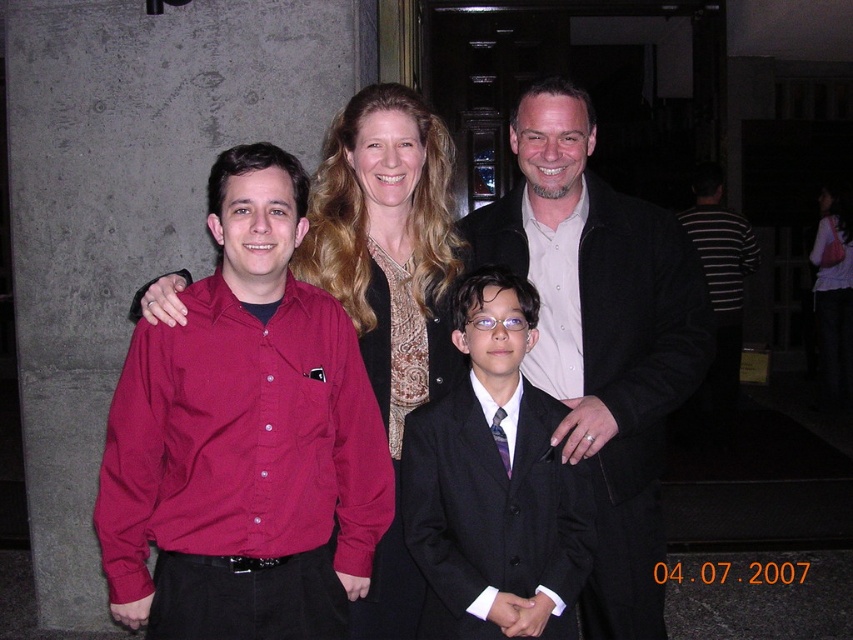
Which is in front, point (463, 598) or point (422, 324)?

Point (463, 598) is in front.

Based on the photo, between black satin suit at center and matte gold necklace at center, which one is positioned higher?

Positioned higher is matte gold necklace at center.

Is point (489, 312) farther from viewer compared to point (404, 570)?

No, (489, 312) is closer to viewer.

Identify the location of black satin suit at center. The width and height of the screenshot is (853, 640). (492, 484).

Can you confirm if matte black suit at center is smaller than matte gold necklace at center?

Incorrect, matte black suit at center is not smaller in size than matte gold necklace at center.

Does matte black suit at center have a lesser width compared to matte gold necklace at center?

No, matte black suit at center is not thinner than matte gold necklace at center.

Which is in front, point (590, 401) or point (332, 248)?

Point (590, 401)

This screenshot has width=853, height=640. I want to click on matte black suit at center, so click(601, 337).

Is matte black suit at center wider than striped cotton shirt at right?

Yes, matte black suit at center is wider than striped cotton shirt at right.

Is matte black suit at center closer to camera compared to striped cotton shirt at right?

Yes, it is in front of striped cotton shirt at right.

Locate an element on the screen. The height and width of the screenshot is (640, 853). matte black suit at center is located at coordinates [601, 337].